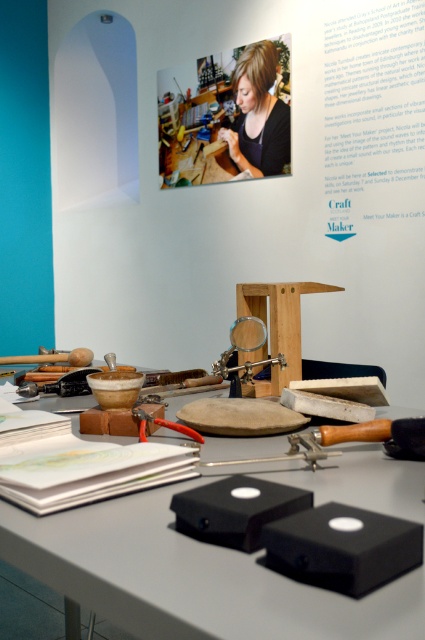
You are organizing a craft workshop and need to ensure participants can see the demonstration clearly. The matte black shirt at upper center and the wooden stool at center are in the way. Which object should you move to improve visibility?

The matte black shirt at upper center is located above the wooden stool at center, so moving the matte black shirt at upper center would improve visibility as it is positioned higher and might obstruct the view more significantly.

You are a person with a height of 160 cm who wants to sit on the wooden stool at center while working at the black matte table at center. Considering the height difference between the two, will your feet touch the ground?

The black matte table at center has a lesser height compared to wooden stool at center. Since the stool is taller than the table, when sitting on it, your feet will likely touch the ground as the stool provides a stable seated position higher than the table surface.

You are standing at the edge of the gray table in the workspace. There are two points marked on the table surface. The first point is at coordinates point (155, 586) and the second point is at point (258, 355). Which point is closer to you?

Point (155, 586) is in front of point (258, 355), so it is closer to you.